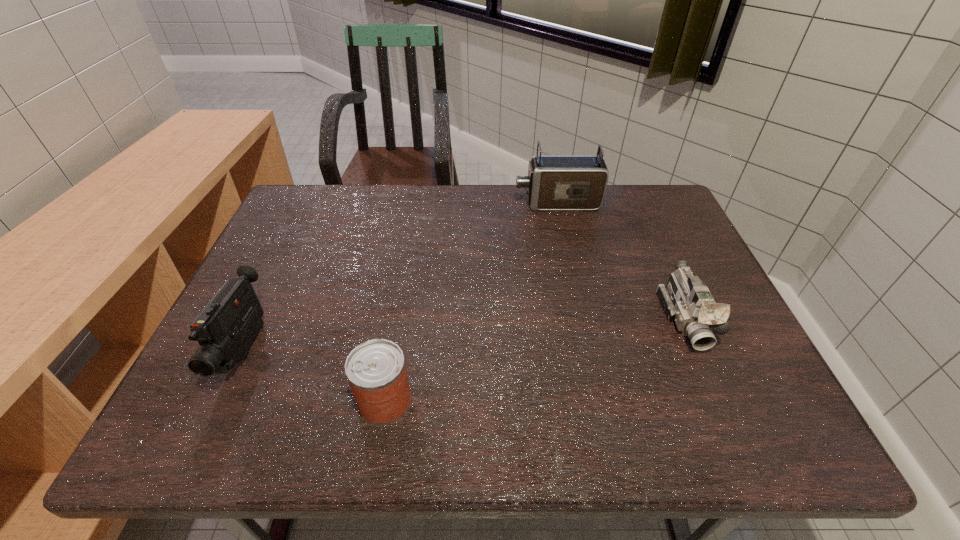
Image resolution: width=960 pixels, height=540 pixels. I want to click on free spot at the right edge of the desktop, so click(670, 245).

Where is `vacant region at the far left corner of the desktop`? vacant region at the far left corner of the desktop is located at coordinates coord(299,217).

I want to click on free space at the near left corner of the desktop, so click(x=232, y=428).

In the image, there is a desktop. At what (x,y) coordinates should I click in order to perform the action: click on free space at the far right corner. Please return your answer as a coordinate pair (x, y). Looking at the image, I should click on (625, 191).

You are a GUI agent. You are given a task and a screenshot of the screen. Output one action in this format:
    pyautogui.click(x=<x>, y=<y>)
    Task: Click on the free space between the can and the second camcorder from right to left
    The width and height of the screenshot is (960, 540).
    Given the screenshot: What is the action you would take?
    pyautogui.click(x=471, y=302)

Identify the location of free spot between the third object from right to left and the farthest object. This screenshot has width=960, height=540. (471, 302).

Find the location of a particular element. The height and width of the screenshot is (540, 960). unoccupied area between the second camcorder from right to left and the rightmost camcorder is located at coordinates (621, 261).

Image resolution: width=960 pixels, height=540 pixels. What are the coordinates of `free space that is in between the second object from right to left and the rightmost object` in the screenshot? It's located at (621, 261).

Find the location of `free space between the leftmost camcorder and the rightmost camcorder`. free space between the leftmost camcorder and the rightmost camcorder is located at coordinates [x=465, y=334].

Locate an element on the screen. free point between the second object from left to right and the rightmost object is located at coordinates (535, 360).